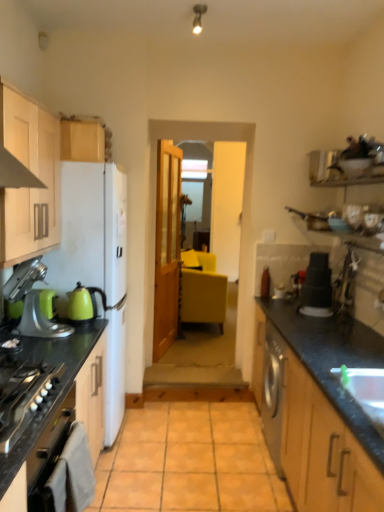
What are the coordinates of `free space in front of satin nickel faucet at right` in the screenshot? It's located at (345, 317).